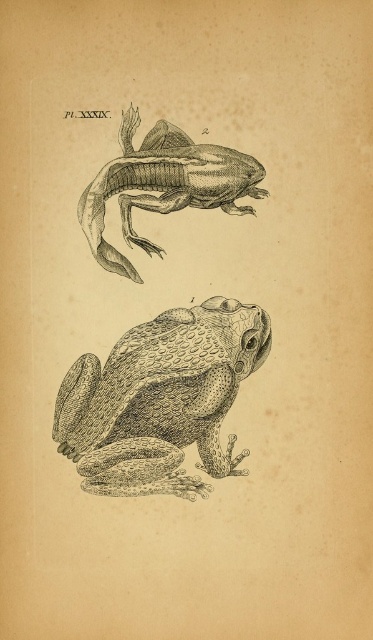
You are an art conservator examining two etched paper frogs in an old book. The scene shows an etched paper frog at center and an etched paper frog at upper center. Which frog do you think has a larger width when measured from left to right?

The etched paper frog at center might be wider than the etched paper frog at upper center according to the description.

You are an art conservator working on a project to display these two etched paper frogs. The display case you have can only accommodate items that are 18 inches apart. Based on the image, will the distance between the etched paper frog at center and the etched paper frog at upper center fit within the display case requirements?

The etched paper frog at center and the etched paper frog at upper center are 17.89 inches apart, which is less than the 18 inches requirement. Therefore, the distance between them will fit within the display case requirements.

You are an art student examining the two frog illustrations. You need to place a label on the etched paper frog at center. Based on their positions in the image, which illustration should you label as number 1?

The etched paper frog at center is located at point (161, 400), which corresponds to the bottom illustration labeled 1. Therefore, you should label the etched paper frog at center as number 1.